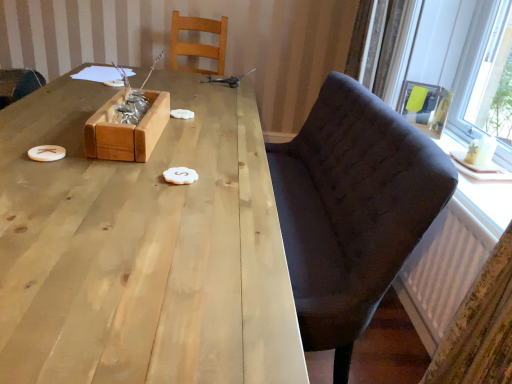
You are a GUI agent. You are given a task and a screenshot of the screen. Output one action in this format:
    pyautogui.click(x=<x>, y=<y>)
    Task: Click on the vacant area on the back side of white matte cookie at center, the 1th food from the top
    The image size is (512, 384).
    Given the screenshot: What is the action you would take?
    pyautogui.click(x=195, y=109)